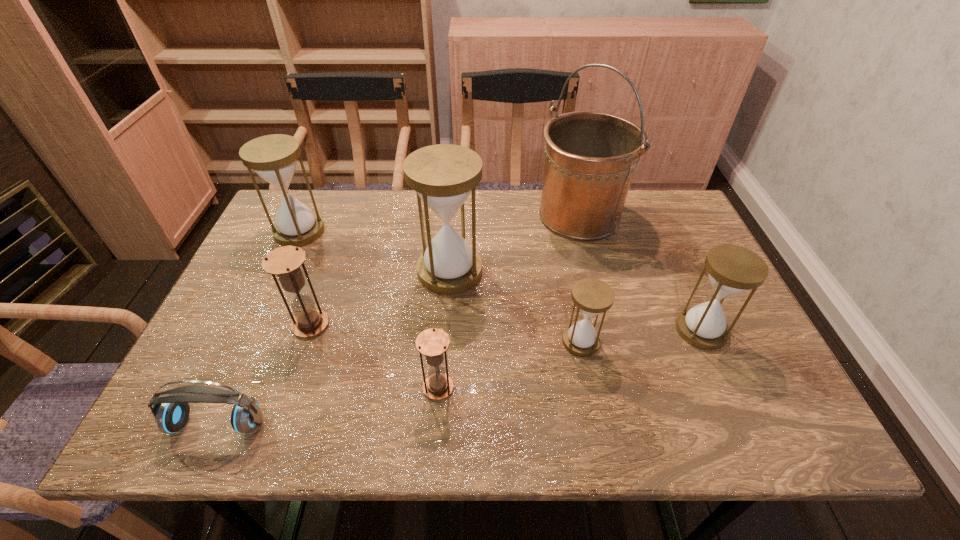
Identify the location of object present at the near left corner. (171, 416).

Image resolution: width=960 pixels, height=540 pixels. I want to click on vacant space at the far edge, so tap(348, 233).

Find the location of a particular element. vacant position at the near edge of the desktop is located at coordinates pyautogui.click(x=513, y=410).

In the image, there is a desktop. Where is `blank space at the left edge`? Image resolution: width=960 pixels, height=540 pixels. blank space at the left edge is located at coordinates (244, 288).

Locate an element on the screen. This screenshot has height=540, width=960. blank area at the right edge is located at coordinates (702, 260).

Locate an element on the screen. This screenshot has width=960, height=540. free spot between the second hourglass from right to left and the blue headset is located at coordinates (399, 382).

Where is `vacant area that lies between the smaller brown hourglass and the smallest white hourglass`? This screenshot has width=960, height=540. vacant area that lies between the smaller brown hourglass and the smallest white hourglass is located at coordinates (510, 364).

Find the location of a particular element. This screenshot has height=540, width=960. free space that is in between the rightmost hourglass and the bucket is located at coordinates (640, 273).

The image size is (960, 540). I want to click on vacant space that is in between the smallest white hourglass and the bucket, so click(580, 279).

In order to click on free space between the farthest hourglass and the blue headset in this screenshot , I will do `click(258, 328)`.